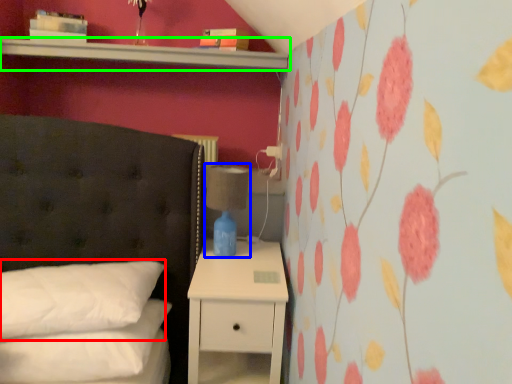
Question: Which object is the farthest from pillow (highlighted by a red box)? Choose among these: bedside lamp (highlighted by a blue box) or shelf (highlighted by a green box).

Choices:
 (A) bedside lamp
 (B) shelf

Answer: (B)